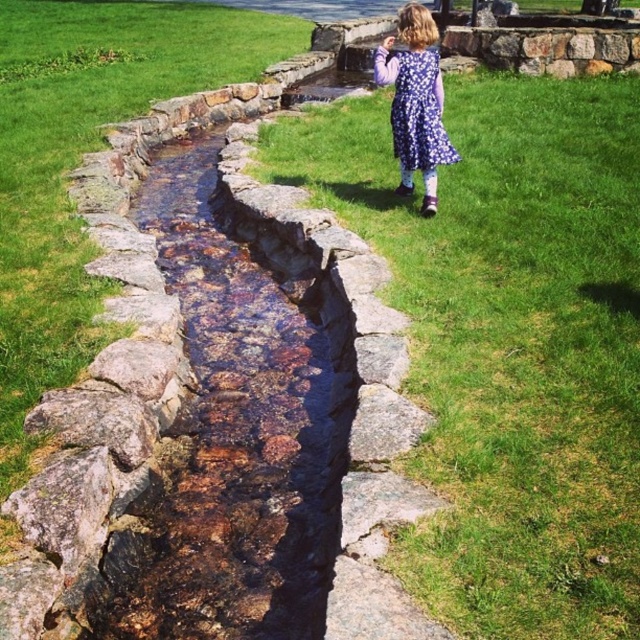
Find the location of `green grass at center`. green grass at center is located at coordinates (509, 340).

Can you confirm if green grass at center is positioned above purple floral dress at upper right?

No, green grass at center is not above purple floral dress at upper right.

This screenshot has width=640, height=640. Identify the location of green grass at center. (509, 340).

Where is `green grass at center`? green grass at center is located at coordinates (509, 340).